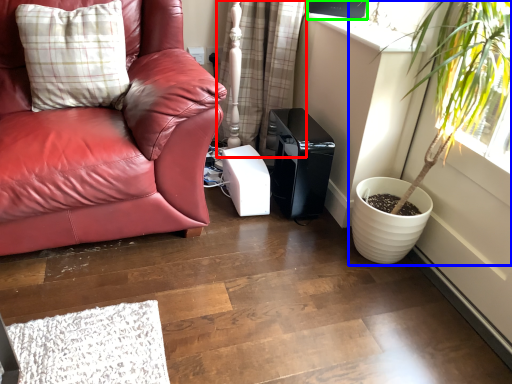
Question: Which is farther away from curtain (highlighted by a red box)? houseplant (highlighted by a blue box) or window screen (highlighted by a green box)?

Choices:
 (A) houseplant
 (B) window screen

Answer: (A)